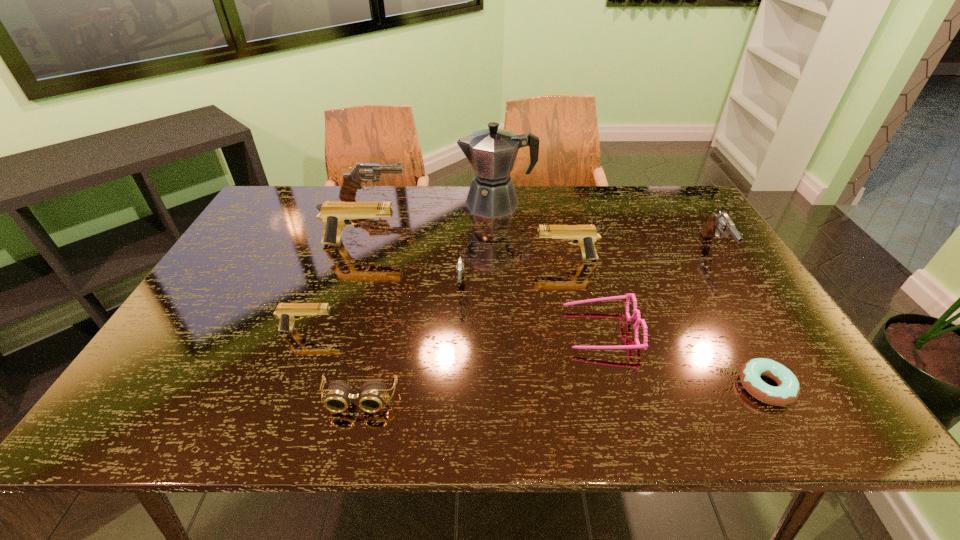
At what (x,y) coordinates should I click in order to perform the action: click on vacant space located on the left of the doughnut. Please return your answer as a coordinate pair (x, y). Looking at the image, I should click on (609, 387).

Where is `coffeepot that is at the far edge`? Image resolution: width=960 pixels, height=540 pixels. coffeepot that is at the far edge is located at coordinates (492, 152).

Where is `pistol at the far edge`? pistol at the far edge is located at coordinates (363, 172).

Where is `goggles that is at the near edge`? goggles that is at the near edge is located at coordinates (371, 397).

Where is `doughnut at the near edge`? The image size is (960, 540). doughnut at the near edge is located at coordinates (788, 389).

This screenshot has height=540, width=960. I want to click on pistol present at the right edge, so click(722, 223).

At what (x,y) coordinates should I click in order to perform the action: click on doughnut located in the right edge section of the desktop. Please return your answer as a coordinate pair (x, y). This screenshot has height=540, width=960. Looking at the image, I should click on (788, 389).

At what (x,y) coordinates should I click in order to perform the action: click on object that is at the near right corner. Please return your answer as a coordinate pair (x, y). The width and height of the screenshot is (960, 540). Looking at the image, I should click on (788, 389).

In the image, there is a desktop. In order to click on vacant space at the far edge in this screenshot , I will do `click(532, 222)`.

Where is `free location at the near edge of the desktop`? This screenshot has width=960, height=540. free location at the near edge of the desktop is located at coordinates (214, 415).